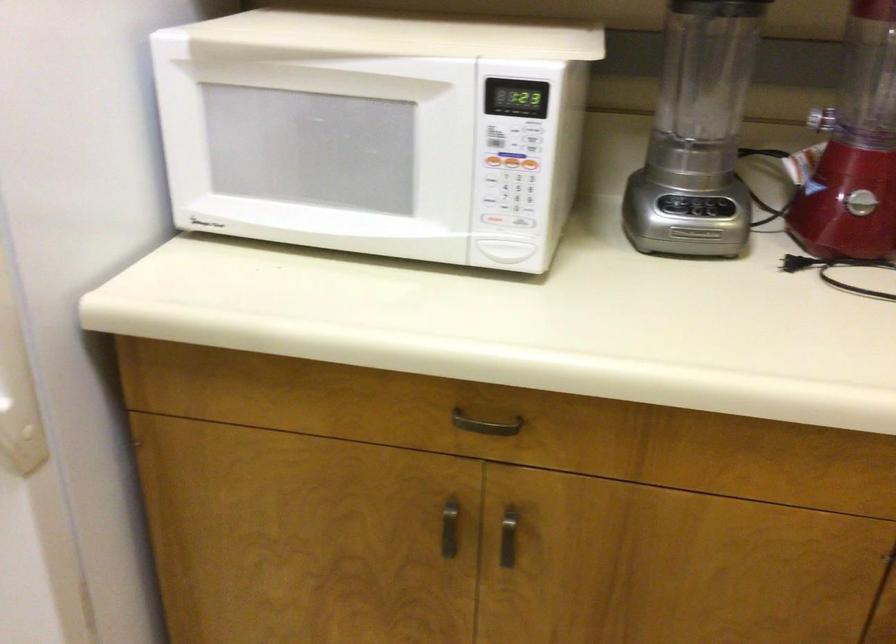
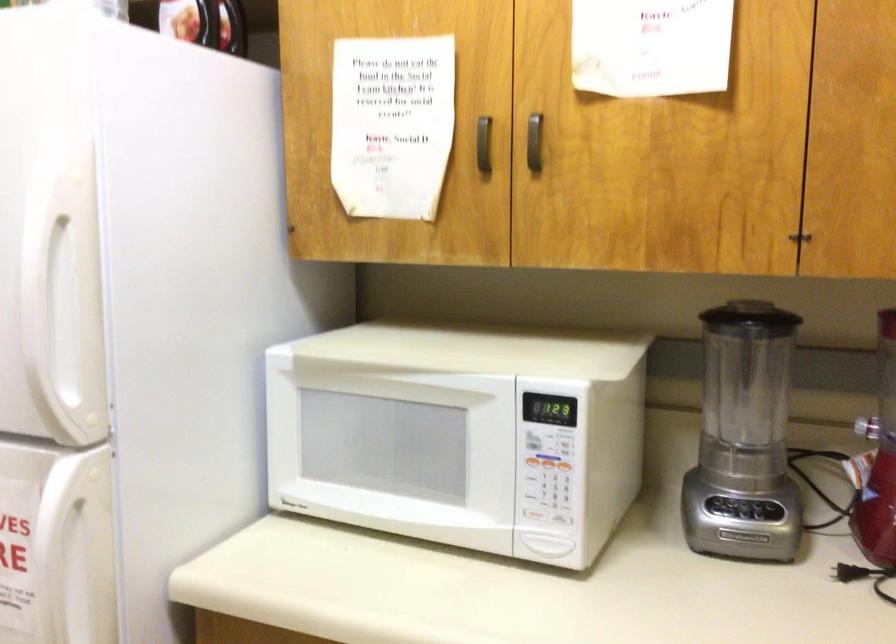
In a continuous first-person perspective shot, in which direction is the camera moving?

The cameraman walked toward right, backward.